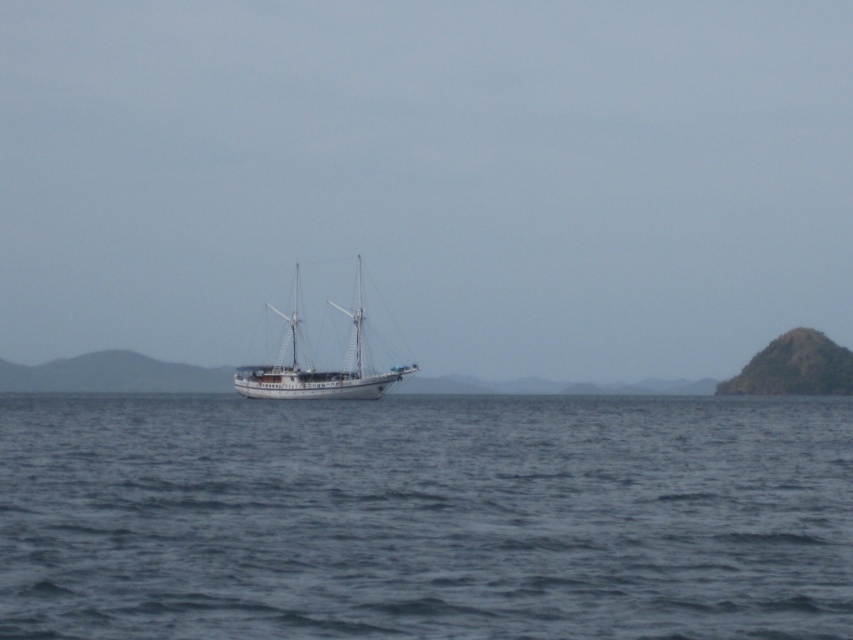
You are an observer positioned at the origin point of the image coordinate system. The ship is anchored at point 0.8, 0.5. Can you determine if the blue water at center is located to the left or right of the ship?

The blue water at center is located at point (x=425, y=516), which is slightly to the right of the ship anchored at (x=426, y=512). Therefore, the blue water at center is to the right of the ship.

You are a sailor on the white matte sailboat at center. You want to check the depth of the water in front of your boat. Can you determine if the blue water at center is deeper than the water directly under your boat?

The blue water at center is in front of white matte sailboat at center, so it is farther away from the boat. However, depth cannot be determined based solely on spatial position. You would need to use a depth sounder or other instruments to accurately measure the water depth.

You are standing on the deck of the ship and looking out towards the horizon. There are two points marked on the scene, point 1 at coordinates point (329,376) and point 2 at coordinates point (786,392). Which point is closer to you?

Point (329,376) is closer to the camera than point (786,392).